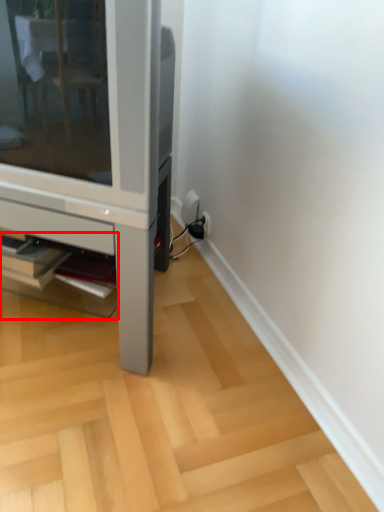
Question: From the image, what is the correct spatial relationship of shelf (annotated by the red box) in relation to furniture?

Choices:
 (A) left
 (B) right

Answer: (B)